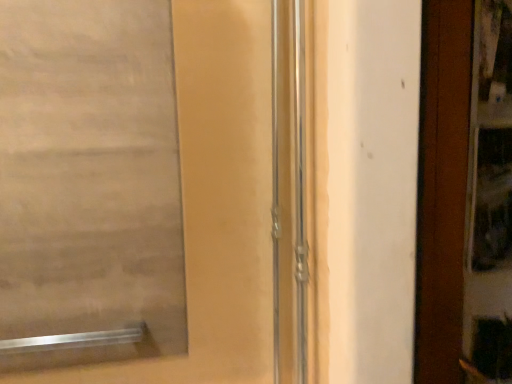
What do you see at coordinates (216, 201) in the screenshot? I see `matte beige door at left` at bounding box center [216, 201].

I want to click on matte beige door at left, so click(x=216, y=201).

This screenshot has width=512, height=384. I want to click on matte beige door at left, so click(216, 201).